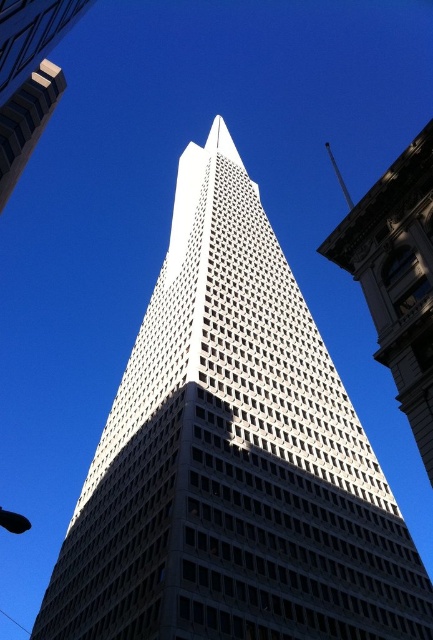
In the scene shown: How much distance is there between white glass skyscraper at center and white glass skyscraper at upper left?

white glass skyscraper at center and white glass skyscraper at upper left are 38.20 meters apart.

Can you confirm if white glass skyscraper at center is positioned to the right of white glass skyscraper at upper left?

Indeed, white glass skyscraper at center is positioned on the right side of white glass skyscraper at upper left.

Locate an element on the screen. white glass skyscraper at center is located at coordinates [x=397, y=276].

The image size is (433, 640). I want to click on white glass skyscraper at center, so click(x=397, y=276).